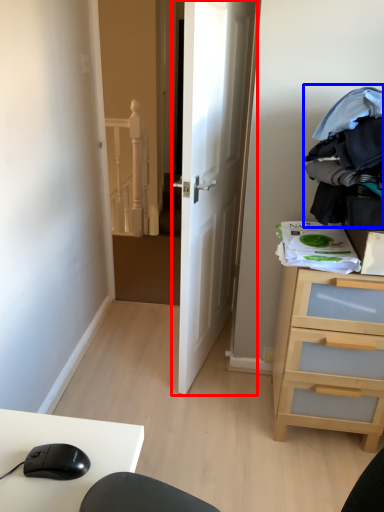
Question: Which of the following is the closest to the observer, door (highlighted by a red box) or clothing (highlighted by a blue box)?

Choices:
 (A) door
 (B) clothing

Answer: (B)